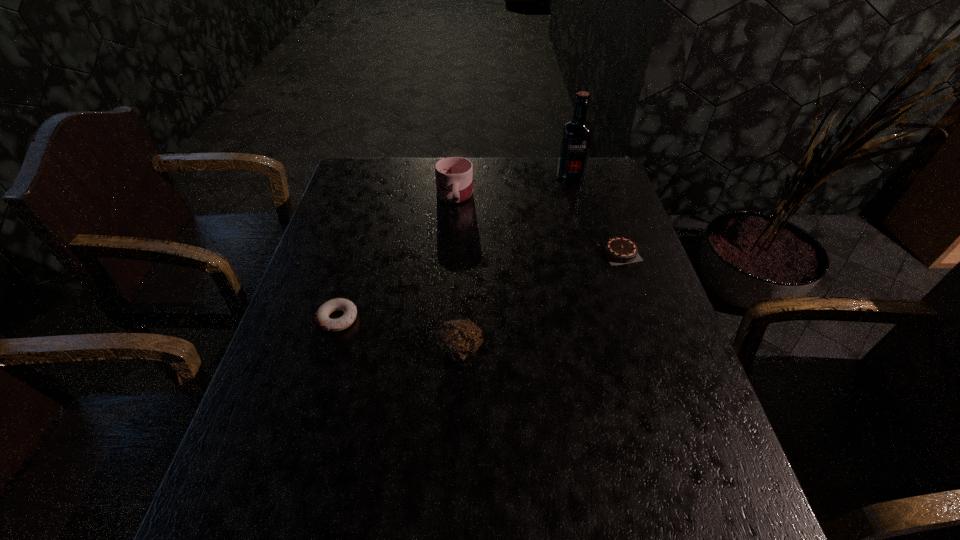
Where is `liquor that is at the far edge`? The height and width of the screenshot is (540, 960). liquor that is at the far edge is located at coordinates (576, 137).

Where is `mug that is at the far edge`? The width and height of the screenshot is (960, 540). mug that is at the far edge is located at coordinates (454, 175).

This screenshot has height=540, width=960. I want to click on object present at the left edge, so click(x=322, y=319).

Identify the location of liquor that is at the right edge. (576, 137).

The width and height of the screenshot is (960, 540). What are the coordinates of `chocolate cake located in the right edge section of the desktop` in the screenshot? It's located at (617, 249).

I want to click on object that is at the far right corner, so click(x=576, y=137).

The image size is (960, 540). What are the coordinates of `vacant space at the near edge` in the screenshot? It's located at (324, 523).

Identify the location of free region at the left edge of the desktop. (280, 445).

In the image, there is a desktop. Identify the location of vacant space at the right edge. (614, 322).

The width and height of the screenshot is (960, 540). What are the coordinates of `vacant space at the far left corner` in the screenshot? It's located at (358, 187).